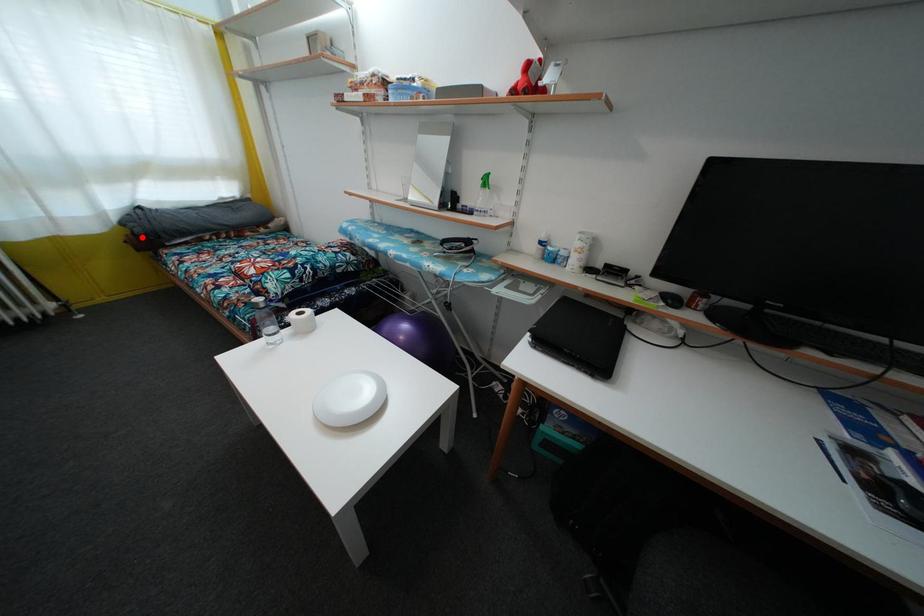
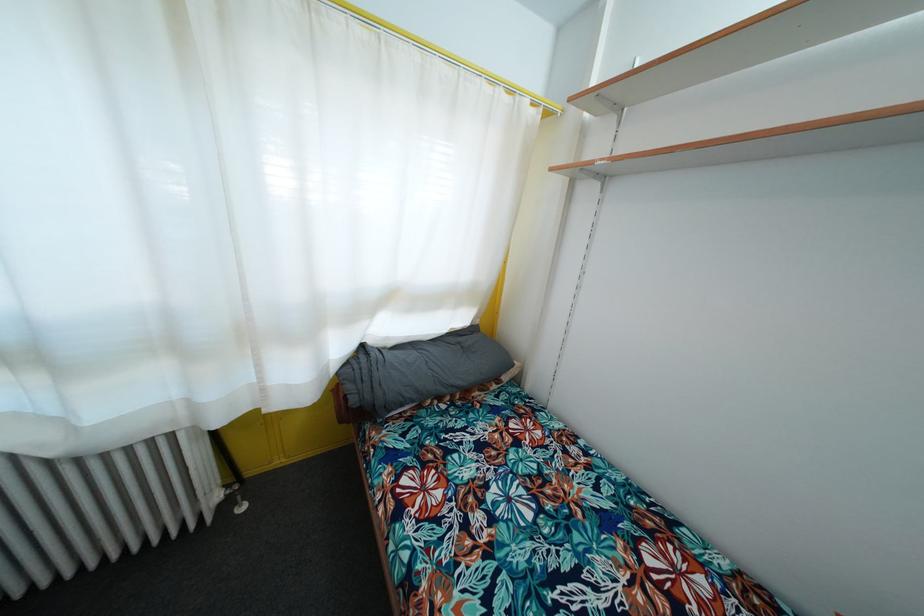
In the second image, find the point that corresponds to the highlighted location in the first image.

(358, 407)